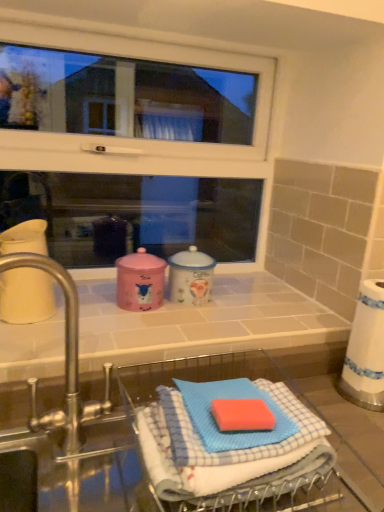
Measure the distance between point (x=192, y=143) and camera.

The depth of point (x=192, y=143) is 4.14 feet.

Find the location of a particular element. silver metallic tap at left is located at coordinates (65, 359).

Measure the distance from white glossy window at upper center to white glossy counter top at center.

white glossy window at upper center and white glossy counter top at center are 17.92 inches apart from each other.

Which object is thinner, white glossy window at upper center or white glossy counter top at center?

white glossy window at upper center is thinner.

From the image's perspective, which object appears higher, white glossy window at upper center or white glossy counter top at center?

From the image's view, white glossy window at upper center is above.

From a real-world perspective, is white glossy window at upper center over white glossy counter top at center?

Yes, from a real-world perspective, white glossy window at upper center is above white glossy counter top at center.

Is white glossy window at upper center turned away from silver metallic tap at left?

white glossy window at upper center is not turned away from silver metallic tap at left.

Is point (76, 276) positioned behind point (43, 430)?

That is True.

From a real-world perspective, which is physically below, white glossy window at upper center or silver metallic tap at left?

silver metallic tap at left.

From the image's perspective, would you say white glossy window at upper center is positioned over silver metallic tap at left?

Yes, from the image's perspective, white glossy window at upper center is on top of silver metallic tap at left.

Does point (346, 330) appear closer or farther from the camera than point (73, 288)?

Clearly, point (346, 330) is more distant from the camera than point (73, 288).

In the image, is white glossy counter top at center on the left side or the right side of silver metallic tap at left?

In the image, white glossy counter top at center appears on the right side of silver metallic tap at left.

Considering the sizes of objects white glossy counter top at center and silver metallic tap at left in the image provided, who is smaller, white glossy counter top at center or silver metallic tap at left?

silver metallic tap at left.

Is silver metallic tap at left wider or thinner than white glossy window at upper center?

Considering their sizes, silver metallic tap at left looks broader than white glossy window at upper center.

From the image's perspective, does silver metallic tap at left appear higher than white glossy window at upper center?

Incorrect, from the image's perspective, silver metallic tap at left is lower than white glossy window at upper center.

Is silver metallic tap at left oriented away from white glossy window at upper center?

Yes, silver metallic tap at left is positioned with its back facing white glossy window at upper center.

From the image's perspective, is blue checkered cloth at lower center below white glossy window at upper center?

Yes, from the image's perspective, blue checkered cloth at lower center is beneath white glossy window at upper center.

Does blue checkered cloth at lower center lie in front of white glossy window at upper center?

Yes, blue checkered cloth at lower center is in front of white glossy window at upper center.

This screenshot has width=384, height=512. Identify the location of window located above the blue checkered cloth at lower center (from a real-world perspective). (146, 140).

Is blue checkered cloth at lower center with white glossy window at upper center?

No, blue checkered cloth at lower center is not touching white glossy window at upper center.

From the image's perspective, is silver metallic tap at left beneath blue checkered cloth at lower center?

No.

Based on their sizes in the image, would you say silver metallic tap at left is bigger or smaller than blue checkered cloth at lower center?

In the image, silver metallic tap at left appears to be larger than blue checkered cloth at lower center.

How many degrees apart are the facing directions of silver metallic tap at left and blue checkered cloth at lower center?

silver metallic tap at left and blue checkered cloth at lower center are facing 0.00143 degrees away from each other.

Is white glossy counter top at center far from blue checkered cloth at lower center?

white glossy counter top at center is near blue checkered cloth at lower center, not far away.

Looking at this image, does white glossy counter top at center come behind blue checkered cloth at lower center?

Yes, it is.

Considering the positions of points (279, 340) and (182, 492), is point (279, 340) closer to camera compared to point (182, 492)?

No, (279, 340) is further to viewer.

Where is `counter top that appears below the white glossy window at upper center (from the image's perspective)`? counter top that appears below the white glossy window at upper center (from the image's perspective) is located at coordinates (203, 323).

You are a GUI agent. You are given a task and a screenshot of the screen. Output one action in this format:
    pyautogui.click(x=<x>, y=<y>)
    Task: Click on the window above the silver metallic tap at left (from a real-world perspective)
    This screenshot has height=512, width=384.
    Given the screenshot: What is the action you would take?
    pyautogui.click(x=146, y=140)

Looking at the image, which one is located closer to white glossy window at upper center, white glossy counter top at center or silver metallic tap at left?

The object closer to white glossy window at upper center is white glossy counter top at center.

Looking at the image, which one is located further to white glossy window at upper center, white glossy counter top at center or blue checkered cloth at lower center?

Among the two, blue checkered cloth at lower center is located further to white glossy window at upper center.

Estimate the real-world distances between objects in this image. Which object is further from blue checkered cloth at lower center, silver metallic tap at left or white glossy window at upper center?

white glossy window at upper center lies further to blue checkered cloth at lower center than the other object.

When comparing their distances from silver metallic tap at left, does white glossy counter top at center or blue checkered cloth at lower center seem further?

blue checkered cloth at lower center lies further to silver metallic tap at left than the other object.

From the image, which object appears to be nearer to white glossy counter top at center, white glossy window at upper center or blue checkered cloth at lower center?

Based on the image, blue checkered cloth at lower center appears to be nearer to white glossy counter top at center.

Looking at the image, which one is located closer to blue checkered cloth at lower center, white glossy window at upper center or white glossy counter top at center?

white glossy counter top at center.

When comparing their distances from silver metallic tap at left, does blue checkered cloth at lower center or white glossy window at upper center seem closer?

blue checkered cloth at lower center.

Based on their spatial positions, is blue checkered cloth at lower center or silver metallic tap at left further from white glossy window at upper center?

Among the two, blue checkered cloth at lower center is located further to white glossy window at upper center.

Image resolution: width=384 pixels, height=512 pixels. Identify the location of tap between white glossy window at upper center and blue checkered cloth at lower center in the up-down direction. (65, 359).

Locate an element on the screen. The image size is (384, 512). counter top between white glossy window at upper center and blue checkered cloth at lower center from top to bottom is located at coordinates (203, 323).

Identify the location of counter top between white glossy window at upper center and silver metallic tap at left vertically. (203, 323).

The image size is (384, 512). In order to click on bath towel between silver metallic tap at left and white glossy counter top at center from front to back in this screenshot , I will do `click(217, 452)`.